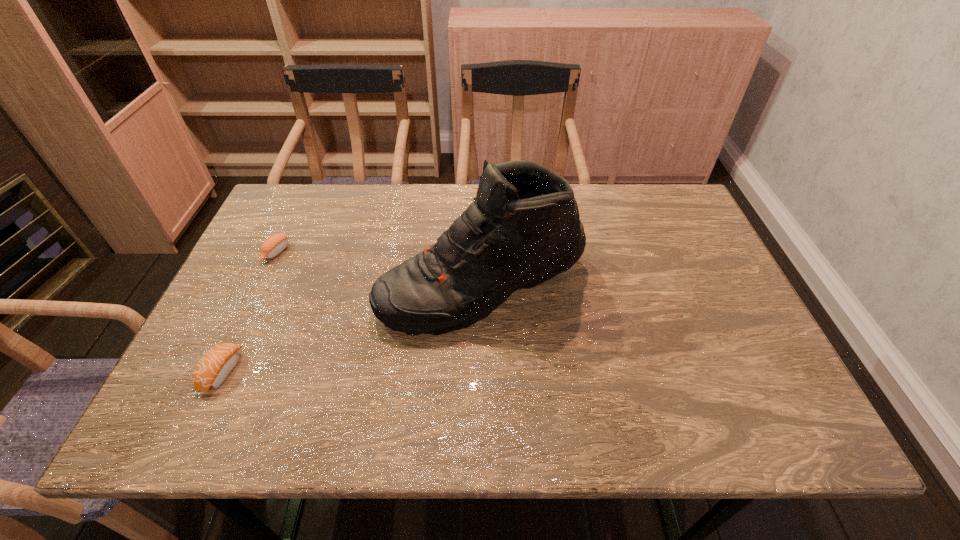
The image size is (960, 540). In the image, there is a desktop. Identify the location of free space at the right edge. (705, 251).

I want to click on vacant space at the far right corner of the desktop, so click(x=660, y=217).

Find the location of a particular element. The image size is (960, 540). vacant space at the near right corner of the desktop is located at coordinates (739, 427).

You are a GUI agent. You are given a task and a screenshot of the screen. Output one action in this format:
    pyautogui.click(x=<x>, y=<y>)
    Task: Click on the free spot between the ski boot and the nearest object
    The image size is (960, 540).
    Given the screenshot: What is the action you would take?
    pyautogui.click(x=352, y=329)

Locate an element on the screen. Image resolution: width=960 pixels, height=540 pixels. vacant space that's between the tallest object and the farther sushi is located at coordinates (379, 270).

The image size is (960, 540). Find the location of `vacant area that lies between the farther sushi and the tallest object`. vacant area that lies between the farther sushi and the tallest object is located at coordinates coord(379,270).

Where is `free space between the rightmost object and the farther sushi`? free space between the rightmost object and the farther sushi is located at coordinates (379, 270).

The width and height of the screenshot is (960, 540). In order to click on free area in between the nearer sushi and the rightmost object in this screenshot , I will do `click(352, 329)`.

Identify the location of blank region between the farther sushi and the nearer sushi. (249, 312).

The height and width of the screenshot is (540, 960). Find the location of `free point between the nearest object and the farther sushi`. free point between the nearest object and the farther sushi is located at coordinates (249, 312).